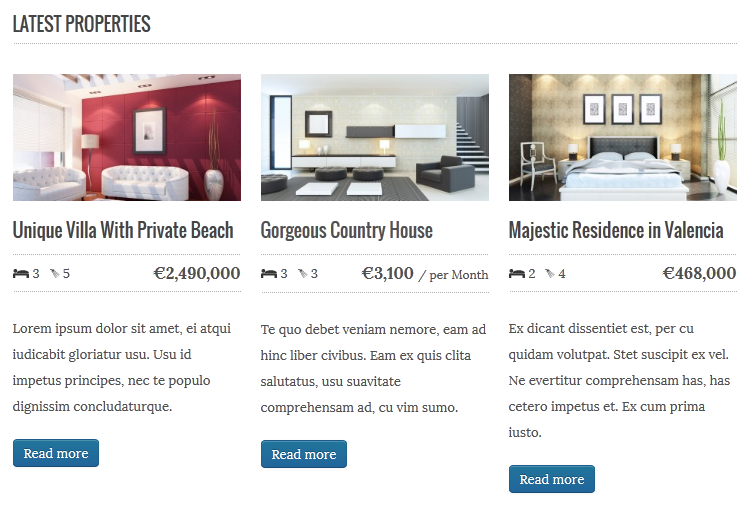
Locate an element on the screen. bed is located at coordinates (629, 174).